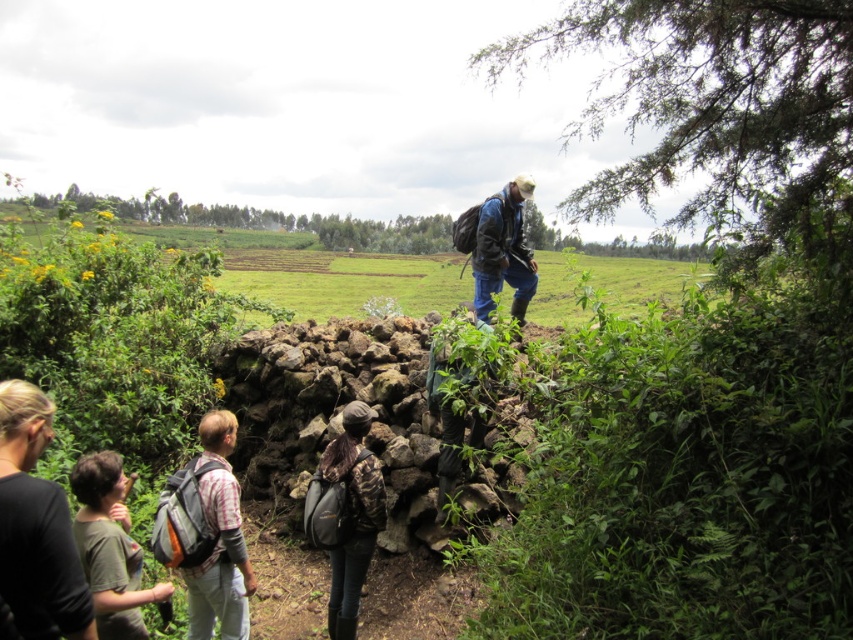
Who is taller, black fabric shirt at lower left or plaid fabric shirt at lower left?

plaid fabric shirt at lower left is taller.

What are the coordinates of `black fabric shirt at lower left` in the screenshot? It's located at (36, 525).

Between point (26, 579) and point (221, 529), which one is positioned in front?

Point (26, 579) is more forward.

Where is `black fabric shirt at lower left`? black fabric shirt at lower left is located at coordinates (36, 525).

Between point (241, 621) and point (500, 228), which one is positioned behind?

Positioned behind is point (500, 228).

Is point (231, 524) more distant than point (524, 280)?

No, it is not.

Which is in front, point (207, 595) or point (483, 208)?

Point (207, 595) is more forward.

Identify the location of plaid fabric shirt at lower left. This screenshot has height=640, width=853. (219, 540).

Which is above, black fabric shirt at lower left or blue fabric jacket at center?

blue fabric jacket at center is higher up.

Does point (45, 568) lie behind point (474, 268)?

That is False.

Where is `black fabric shirt at lower left`? Image resolution: width=853 pixels, height=640 pixels. black fabric shirt at lower left is located at coordinates (36, 525).